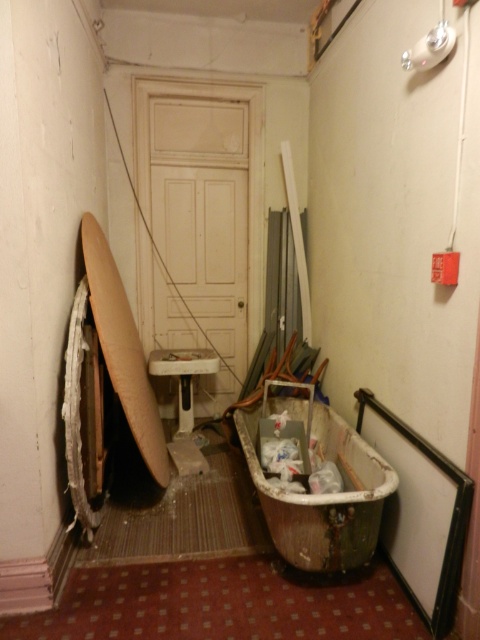
Question: Can you confirm if rusty metal bathtub at center is thinner than light brown wooden surfboard at left?

Choices:
 (A) no
 (B) yes

Answer: (A)

Question: Can you confirm if white matte door at center is positioned below light brown wooden surfboard at left?

Choices:
 (A) no
 (B) yes

Answer: (A)

Question: Among these objects, which one is farthest from the camera?

Choices:
 (A) light brown wooden surfboard at left
 (B) rusty metal bathtub at center

Answer: (A)

Question: Which of the following is the farthest from the observer?

Choices:
 (A) rusty metal bathtub at center
 (B) white matte door at center
 (C) light brown wooden surfboard at left

Answer: (B)

Question: Which of the following is the farthest from the observer?

Choices:
 (A) rusty metal bathtub at center
 (B) white matte door at center

Answer: (B)

Question: Can you confirm if rusty metal bathtub at center is positioned below light brown wooden surfboard at left?

Choices:
 (A) yes
 (B) no

Answer: (A)